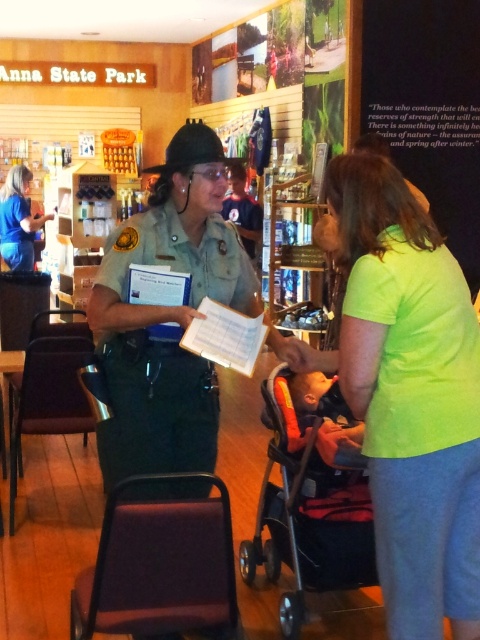
You are a visitor at Anna State Park and need to find the entrance to the hiking trails. You see the black plastic baby carriage at lower center. Based on its location, which direction should you head from the carriage to reach the trails?

The black plastic baby carriage at lower center is located at point (308, 509). Since the entrance sign is above the entrance mentioned in the scene, heading towards the lower center might lead towards the trails, but the exact direction requires more spatial context not provided here.

You are a visitor at Anna State Park and you want to find the baby carriage you left behind. According to the scene description, where would you look for the black plastic baby carriage at lower center?

The black plastic baby carriage at lower center is located at point [308,509] in the scene.